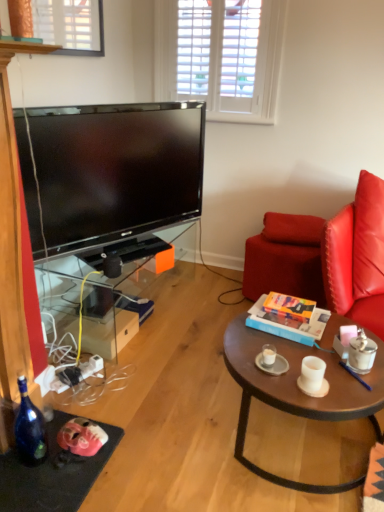
Image resolution: width=384 pixels, height=512 pixels. In order to click on vacant space that is in between white matte coffee cup at center right, placed as the 2th coffee cup when sorted from right to left, and black plastic pen at center in this screenshot , I will do `click(351, 380)`.